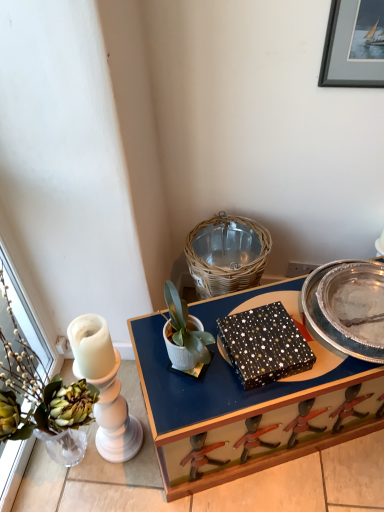
Question: Considering the relative sizes of silver metallic picture frame at upper right and white matte pot at center in the image provided, is silver metallic picture frame at upper right bigger than white matte pot at center?

Choices:
 (A) yes
 (B) no

Answer: (B)

Question: Is silver metallic picture frame at upper right looking in the opposite direction of white matte pot at center?

Choices:
 (A) no
 (B) yes

Answer: (A)

Question: Is the surface of silver metallic picture frame at upper right in direct contact with white matte pot at center?

Choices:
 (A) yes
 (B) no

Answer: (B)

Question: Is silver metallic picture frame at upper right further to the viewer compared to white matte pot at center?

Choices:
 (A) yes
 (B) no

Answer: (A)

Question: Is silver metallic picture frame at upper right not near white matte pot at center?

Choices:
 (A) no
 (B) yes

Answer: (A)

Question: Is black textured box at center bigger or smaller than white matte pot at center?

Choices:
 (A) big
 (B) small

Answer: (B)

Question: From a real-world perspective, is black textured box at center positioned above or below white matte pot at center?

Choices:
 (A) below
 (B) above

Answer: (A)

Question: Is black textured box at center inside or outside of white matte pot at center?

Choices:
 (A) outside
 (B) inside

Answer: (A)

Question: From the image's perspective, relative to white matte pot at center, is black textured box at center above or below?

Choices:
 (A) above
 (B) below

Answer: (B)

Question: Is silver metallic picture frame at upper right inside or outside of matte black box at center?

Choices:
 (A) inside
 (B) outside

Answer: (B)

Question: From the image's perspective, is silver metallic picture frame at upper right above or below matte black box at center?

Choices:
 (A) below
 (B) above

Answer: (B)

Question: Does point [357, 20] appear closer or farther from the camera than point [264, 296]?

Choices:
 (A) closer
 (B) farther

Answer: (A)

Question: From a real-world perspective, is silver metallic picture frame at upper right physically located above or below matte black box at center?

Choices:
 (A) above
 (B) below

Answer: (A)

Question: From the image's perspective, relative to silver metallic picture frame at upper right, is white matte pot at center above or below?

Choices:
 (A) above
 (B) below

Answer: (B)

Question: Is point (173, 323) positioned closer to the camera than point (375, 64)?

Choices:
 (A) closer
 (B) farther

Answer: (A)